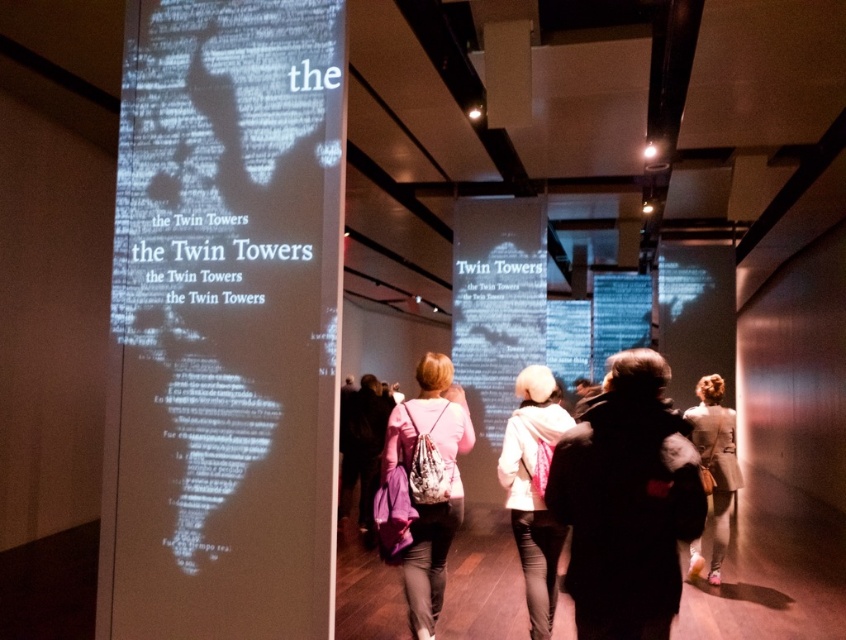
You are standing in the corridor and see two points marked on the wall. The first point is at coordinates point [504,483] and the second is at point [740,484]. Which point is closer to you?

Point [504,483] is closer to the viewer than point [740,484].

You are standing in the corridor and want to pick up both the pink fabric bag at center and the light beige coat at lower right. Which object should you reach for first based on their positions?

The pink fabric bag at center is closer to the viewer than the light beige coat at lower right, so you should reach for the pink fabric bag at center first.